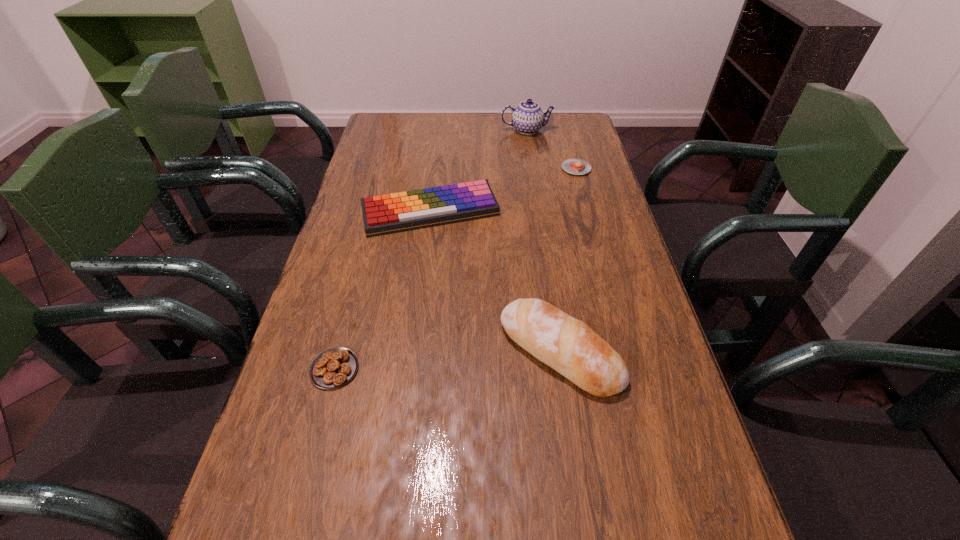
Image resolution: width=960 pixels, height=540 pixels. In the image, there is a desktop. Find the location of `blank space at the far edge`. blank space at the far edge is located at coordinates point(486,130).

The height and width of the screenshot is (540, 960). I want to click on blank space at the left edge, so click(359, 284).

In the image, there is a desktop. Find the location of `free space at the right edge`. free space at the right edge is located at coordinates (585, 217).

You are a GUI agent. You are given a task and a screenshot of the screen. Output one action in this format:
    pyautogui.click(x=<x>, y=<y>)
    Task: Click on the vacant space in between the nearer pastry and the farthest object
    The image size is (960, 540).
    Given the screenshot: What is the action you would take?
    pyautogui.click(x=431, y=249)

In order to click on free area in between the tallest object and the fourth shortest object in this screenshot , I will do [x=543, y=241].

Where is `empty space that is in between the bread and the left pastry`? This screenshot has width=960, height=540. empty space that is in between the bread and the left pastry is located at coordinates (447, 361).

The width and height of the screenshot is (960, 540). Identify the location of vacant space that is in between the left pastry and the second farthest object. (455, 269).

At what (x,y) coordinates should I click in order to perform the action: click on empty space between the bread and the left pastry. Please return your answer as a coordinate pair (x, y). This screenshot has width=960, height=540. Looking at the image, I should click on (447, 361).

Image resolution: width=960 pixels, height=540 pixels. I want to click on free space between the chinaware and the computer keyboard, so click(x=479, y=171).

The width and height of the screenshot is (960, 540). Identify the location of unoccupied position between the third shortest object and the fourth shortest object. (495, 282).